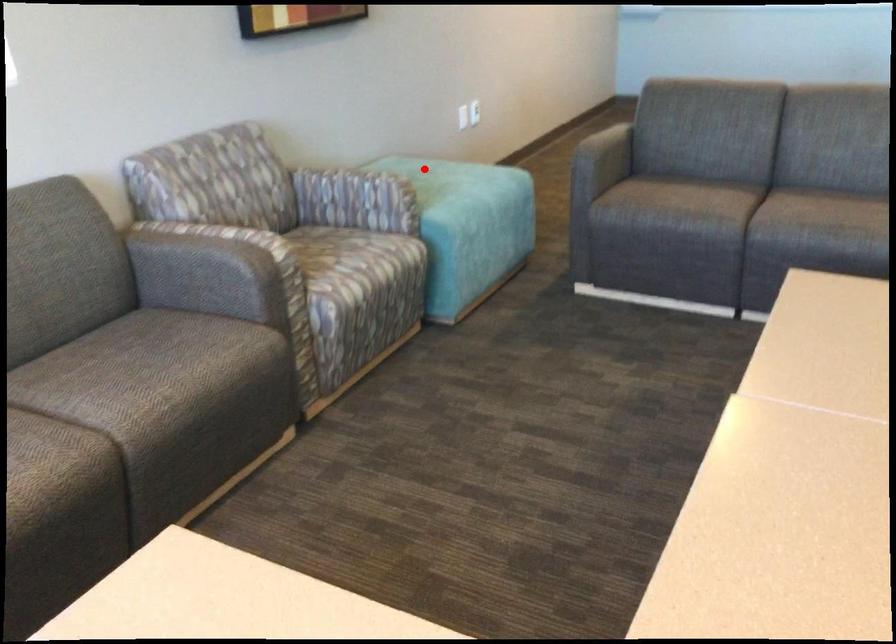
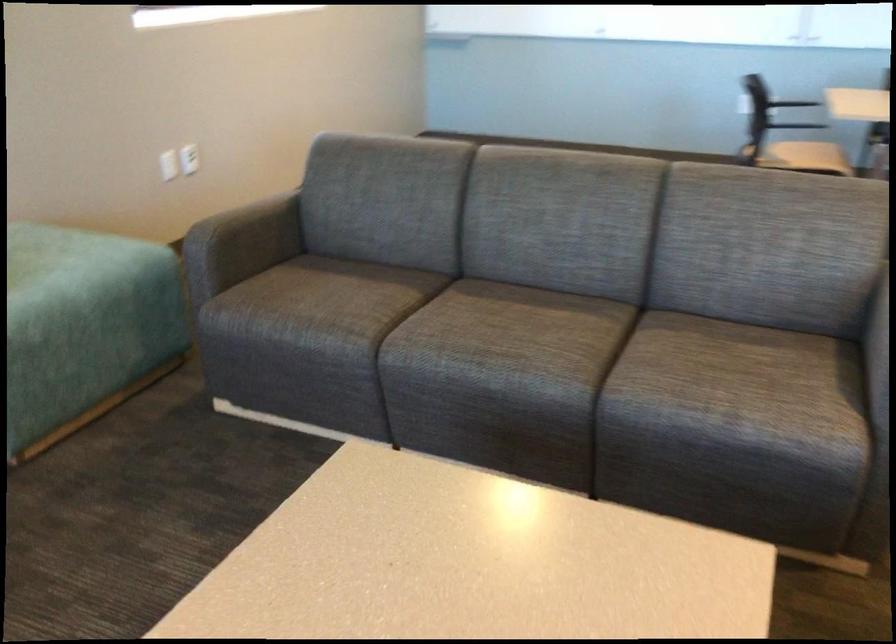
In the second image, find the point that corresponds to the highlighted location in the first image.

(56, 251)